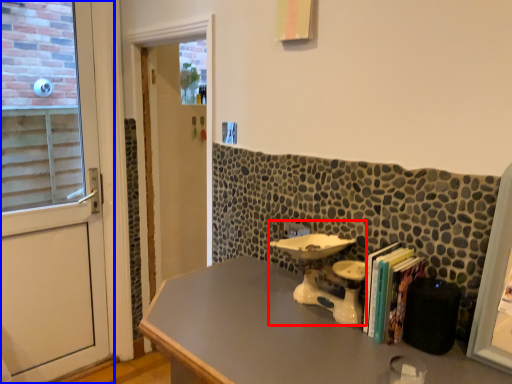
Question: Which of the following is the farthest to the observer, sink (highlighted by a red box) or door (highlighted by a blue box)?

Choices:
 (A) sink
 (B) door

Answer: (B)